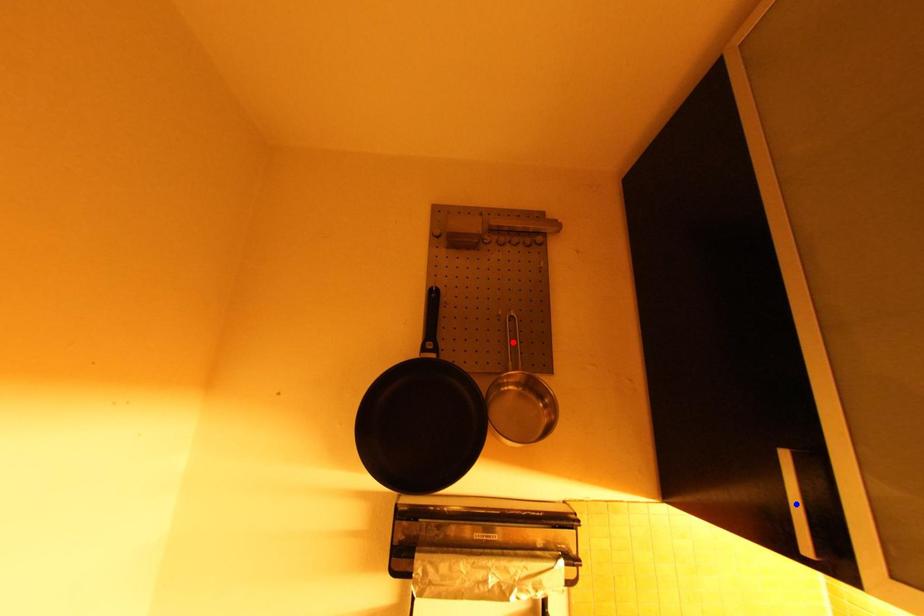
Question: Which of the two points in the image is closer to the camera?

Choices:
 (A) Blue point is closer.
 (B) Red point is closer.

Answer: (A)